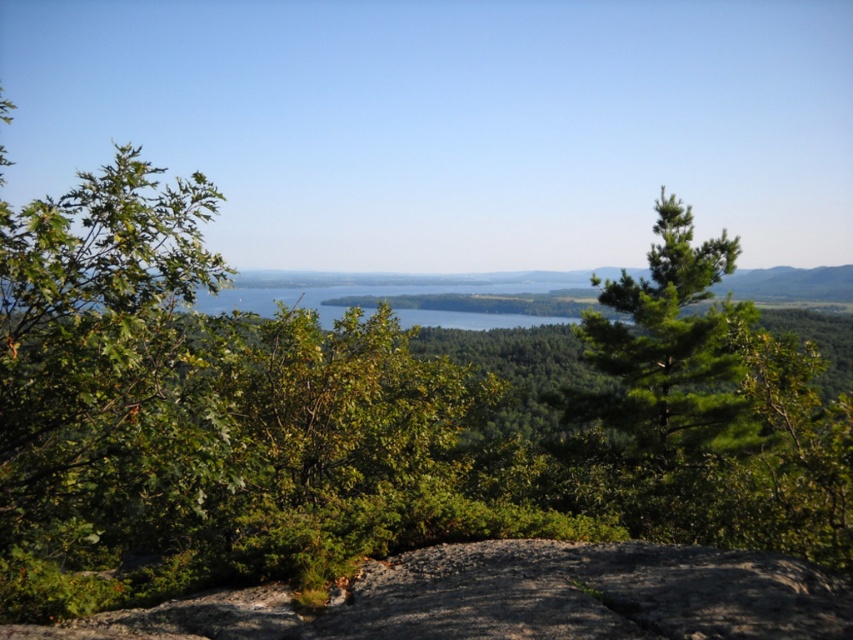
You are standing at the edge of a cliff overlooking a lush landscape. You see a gray rough rock at center. Can you safely walk towards it without falling off the cliff if you are 10 feet away from the cliff edge?

The gray rough rock at center is 12.86 feet away from you. Since you are only 10 feet away from the cliff edge, walking towards the rock would bring you closer to the edge, potentially causing a dangerous situation. It is not safe to proceed.

You are standing at the edge of the rocky outcrop and want to place a small flag at the gray rough rock at center. According to the coordinates provided, where exactly should you place the flag?

The gray rough rock at center is located at point (514, 598), so you should place the flag at those coordinates to mark its position.